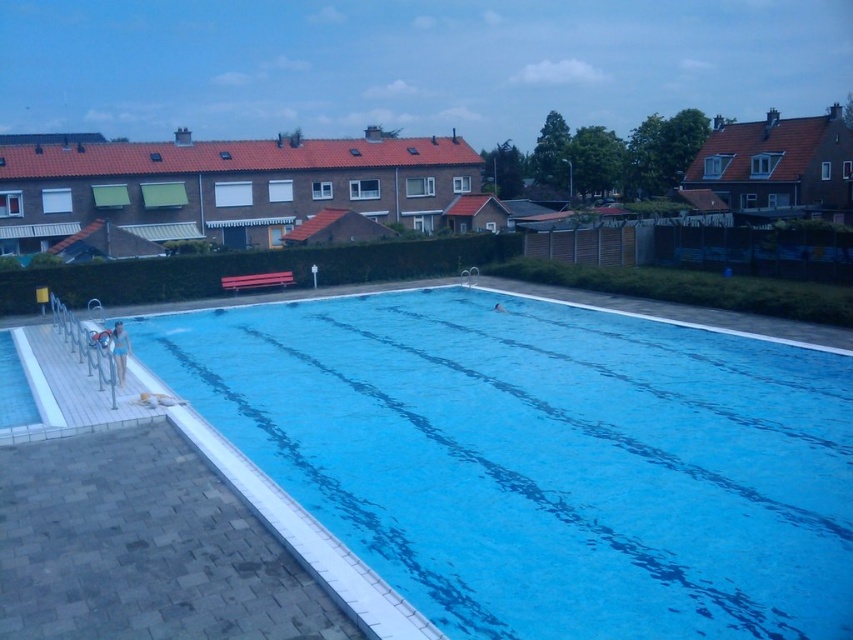
Is blue smooth water at center thinner than matte blue swimsuit at lower left?

Incorrect, blue smooth water at center's width is not less than matte blue swimsuit at lower left's.

Based on the photo, does blue smooth water at center lie in front of matte blue swimsuit at lower left?

Yes.

This screenshot has height=640, width=853. In order to click on blue smooth water at center in this screenshot , I will do `click(543, 458)`.